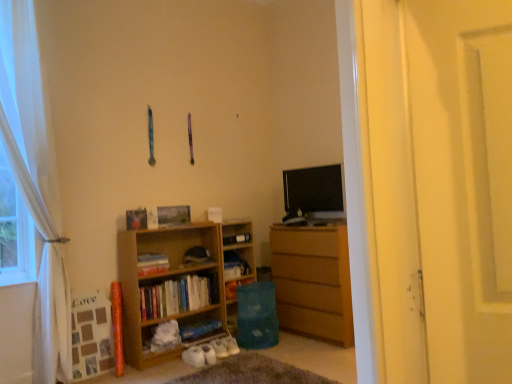
From the picture: Measure the distance between point (133, 306) and camera.

The distance of point (133, 306) from camera is 3.31 meters.

Locate an element on the screen. The height and width of the screenshot is (384, 512). wooden bookshelf at center is located at coordinates (236, 263).

Image resolution: width=512 pixels, height=384 pixels. What do you see at coordinates (252, 372) in the screenshot?
I see `white fluffy slippers at lower center` at bounding box center [252, 372].

Find the location of a particular element. This screenshot has height=384, width=512. matte black tv at upper right is located at coordinates (314, 192).

Image resolution: width=512 pixels, height=384 pixels. I want to click on hardcover book at center, the 2th book in the top-to-bottom sequence, so click(152, 264).

This screenshot has height=384, width=512. I want to click on white sheer curtain at left, so coord(35,184).

Where is `wooden chest of drawers at right`? The image size is (512, 384). wooden chest of drawers at right is located at coordinates (313, 281).

Is wooden chest of drawers at right surrounding matte black tv at upper right?

Actually, matte black tv at upper right is outside wooden chest of drawers at right.

Considering the positions of objects wooden chest of drawers at right and matte black tv at upper right in the image provided, who is more to the left, wooden chest of drawers at right or matte black tv at upper right?

matte black tv at upper right is more to the left.

Is wooden chest of drawers at right looking in the opposite direction of matte black tv at upper right?

wooden chest of drawers at right does not have its back to matte black tv at upper right.

Considering the sizes of objects wooden chest of drawers at right and matte black tv at upper right in the image provided, who is shorter, wooden chest of drawers at right or matte black tv at upper right?

Standing shorter between the two is matte black tv at upper right.

Does matte black tv at upper right have a greater width compared to wooden bookshelf at center?

In fact, matte black tv at upper right might be narrower than wooden bookshelf at center.

From a real-world perspective, who is located higher, matte black tv at upper right or wooden bookshelf at center?

matte black tv at upper right, from a real-world perspective.

Can wooden bookshelf at center be found inside matte black tv at upper right?

No, wooden bookshelf at center is not surrounded by matte black tv at upper right.

Considering the relative sizes of matte black tv at upper right and wooden bookshelf at center in the image provided, is matte black tv at upper right bigger than wooden bookshelf at center?

No.

Locate an element on the screen. The height and width of the screenshot is (384, 512). cupboard that is in front of the hardcover book at center, which is the first book in top-to-bottom order is located at coordinates (177, 285).

Does wooden bookshelf at center have a larger size compared to hardcover book at center, which is the first book in top-to-bottom order?

Yes, wooden bookshelf at center is bigger than hardcover book at center, which is the first book in top-to-bottom order.

Considering the relative positions of wooden bookshelf at center and hardcover book at center, the fourth book in the bottom-to-top sequence, in the image provided, is wooden bookshelf at center to the right of hardcover book at center, the fourth book in the bottom-to-top sequence, from the viewer's perspective?

In fact, wooden bookshelf at center is to the left of hardcover book at center, the fourth book in the bottom-to-top sequence.

How different are the orientations of wooden bookshelf at center and hardcover book at center, which is the first book in top-to-bottom order, in degrees?

They differ by 0.221 degrees in their facing directions.

Which is less distant, [22,100] or [238,220]?

Point [22,100] appears to be closer to the viewer than point [238,220].

Is white sheer curtain at left closer to camera compared to wooden bookshelf at center?

→ Yes, white sheer curtain at left is in front of wooden bookshelf at center.

Which object is positioned more to the left, white sheer curtain at left or wooden bookshelf at center?

Positioned to the left is white sheer curtain at left.

Where is `curtain that is above the wooden bookshelf at center (from the image's perspective)`? The height and width of the screenshot is (384, 512). curtain that is above the wooden bookshelf at center (from the image's perspective) is located at coordinates pos(35,184).

Is hardcover book at center, the 3th book ordered from the bottom, at the back of wooden bookshelf at center?

Yes, wooden bookshelf at center is facing away from hardcover book at center, the 3th book ordered from the bottom.

Is hardcover book at center, the 2th book in the top-to-bottom sequence, inside wooden bookshelf at center?

Yes.

From the image's perspective, is wooden bookshelf at center under hardcover book at center, the 3th book ordered from the bottom?

Yes, from the image's perspective, wooden bookshelf at center is below hardcover book at center, the 3th book ordered from the bottom.

Between wooden bookshelf at center and hardcover book at center, the 3th book ordered from the bottom, which one has larger size?

wooden bookshelf at center is bigger.

From a real-world perspective, is wooden bookshelf at center located higher than white fluffy slippers at lower center?

Correct, in the physical world, wooden bookshelf at center is higher than white fluffy slippers at lower center.

Can you tell me how much wooden bookshelf at center and white fluffy slippers at lower center differ in facing direction?

The facing directions of wooden bookshelf at center and white fluffy slippers at lower center are 88.9 degrees apart.

Based on the photo, is wooden bookshelf at center with white fluffy slippers at lower center?

No, wooden bookshelf at center is not making contact with white fluffy slippers at lower center.

From the image's perspective, is matte black tv at upper right under blue matte book at lower center, arranged as the fourth book when viewed from the top?

Incorrect, from the image's perspective, matte black tv at upper right is higher than blue matte book at lower center, arranged as the fourth book when viewed from the top.

Is point (296, 173) farther from camera compared to point (216, 327)?

That is True.

Between matte black tv at upper right and blue matte book at lower center, acting as the first book starting from the bottom, which one is positioned in front?

blue matte book at lower center, acting as the first book starting from the bottom, is closer to the camera.

Between matte black tv at upper right and blue matte book at lower center, acting as the first book starting from the bottom, which one has less height?

blue matte book at lower center, acting as the first book starting from the bottom.

The height and width of the screenshot is (384, 512). I want to click on open located above the wooden chest of drawers at right (from the image's perspective), so click(314, 192).

Locate an element on the screen. This screenshot has height=384, width=512. cabinet below the matte black tv at upper right (from the image's perspective) is located at coordinates (236, 263).

Based on their spatial positions, is white sheer curtain at left or white fluffy slippers at lower center closer to wooden bookshelf at center?

white fluffy slippers at lower center.

From the image, which object appears to be nearer to white sheer curtain at left, hardcover book at center, which is the first book in top-to-bottom order, or wooden bookshelf at center?

The object closer to white sheer curtain at left is wooden bookshelf at center.

From the image, which object appears to be farther from wooden chest of drawers at right, hardcover book at center, which is the first book in top-to-bottom order, or wooden bookshelf at center?

The object further to wooden chest of drawers at right is hardcover book at center, which is the first book in top-to-bottom order.

From the image, which object appears to be nearer to white fluffy slippers at lower center, blue matte book at lower center, arranged as the fourth book when viewed from the top, or matte black tv at upper right?

The object closer to white fluffy slippers at lower center is blue matte book at lower center, arranged as the fourth book when viewed from the top.

When comparing their distances from white sheer curtain at left, does hardcover book at center, the 3th book ordered from the bottom, or matte black tv at upper right seem closer?

hardcover book at center, the 3th book ordered from the bottom, lies closer to white sheer curtain at left than the other object.

From the image, which object appears to be nearer to wooden bookshelf at center, matte black tv at upper right or wooden bookshelf at center, the 2th book when ordered from bottom to top?

Among the two, wooden bookshelf at center, the 2th book when ordered from bottom to top, is located nearer to wooden bookshelf at center.

Based on their spatial positions, is wooden bookshelf at center or hardcover book at center, the 2th book in the top-to-bottom sequence, closer to wooden chest of drawers at right?

wooden bookshelf at center.

Which object lies nearer to the anchor point matte black tv at upper right, white fluffy slippers at lower center or wooden chest of drawers at right?

wooden chest of drawers at right.

The image size is (512, 384). I want to click on cabinet between hardcover book at center, the 2th book in the top-to-bottom sequence, and wooden chest of drawers at right from left to right, so click(x=236, y=263).

Find the location of a particular element. The image size is (512, 384). cupboard between white fluffy slippers at lower center and matte black tv at upper right from front to back is located at coordinates (177, 285).

Locate an element on the screen. The width and height of the screenshot is (512, 384). open located between white fluffy slippers at lower center and wooden bookshelf at center in the depth direction is located at coordinates (314, 192).

At what (x,y) coordinates should I click in order to perform the action: click on plain between white matte screen door at right and white sheer curtain at left in the front-back direction. Please return your answer as a coordinate pair (x, y). The height and width of the screenshot is (384, 512). Looking at the image, I should click on (252, 372).